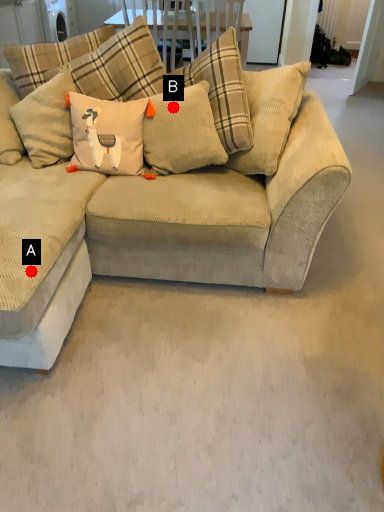
Question: Two points are circled on the image, labeled by A and B beside each circle. Which point is farther to the camera?

Choices:
 (A) A is further
 (B) B is further

Answer: (B)